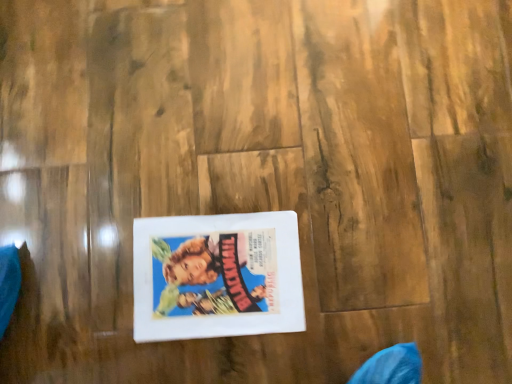
This screenshot has width=512, height=384. What are the coordinates of `free space above white paper flyer at center (from a real-world perspective)` in the screenshot? It's located at (220, 274).